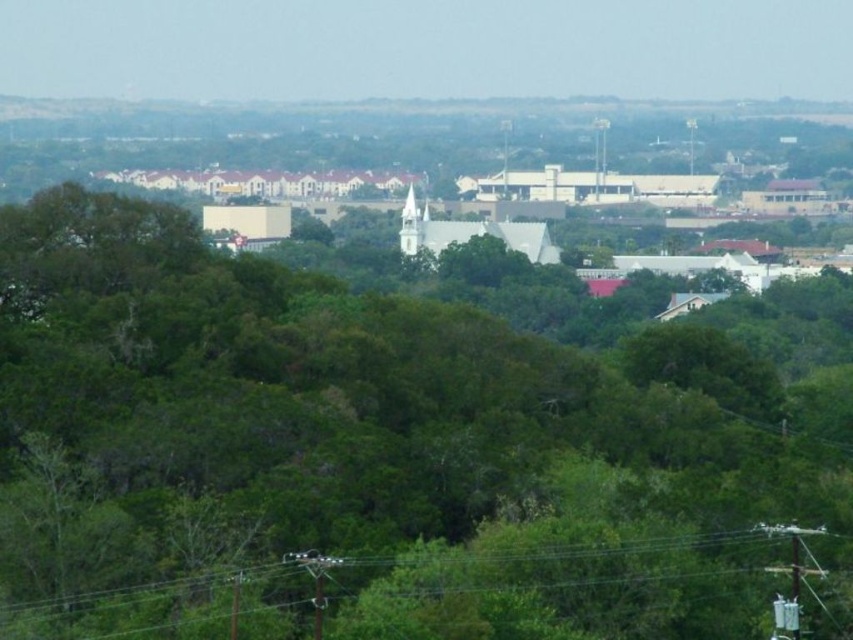
Locate an element on the screen. This screenshot has width=853, height=640. green leafy tree at center is located at coordinates (392, 451).

Is green leafy tree at center behind green wire at lower center?

No, green leafy tree at center is in front of green wire at lower center.

Describe the element at coordinates (392, 451) in the screenshot. This screenshot has height=640, width=853. I see `green leafy tree at center` at that location.

The image size is (853, 640). In order to click on green leafy tree at center in this screenshot , I will do (x=392, y=451).